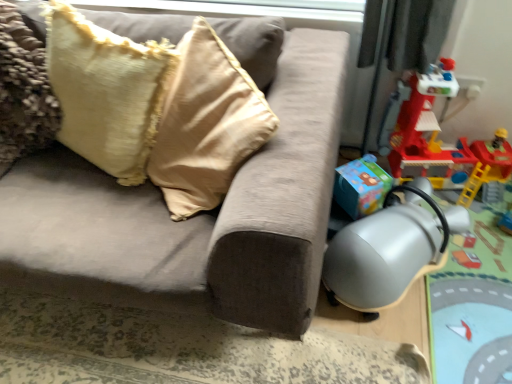
Image resolution: width=512 pixels, height=384 pixels. What do you see at coordinates (197, 215) in the screenshot? I see `suede-like beige couch at center` at bounding box center [197, 215].

At what (x,y) coordinates should I click in order to perform the action: click on suede-like beige couch at center. Please return your answer as a coordinate pair (x, y). Looking at the image, I should click on (197, 215).

Which object is positioned more to the left, velvet beige pillow at upper left or suede-like beige couch at center?

Positioned to the left is suede-like beige couch at center.

Is velvet beige pillow at upper left facing towards suede-like beige couch at center?

Yes, velvet beige pillow at upper left faces towards suede-like beige couch at center.

Is velvet beige pillow at upper left wider or thinner than suede-like beige couch at center?

In the image, velvet beige pillow at upper left appears to be more narrow than suede-like beige couch at center.

From the image's perspective, which object appears higher, velvet beige pillow at upper left or suede-like beige couch at center?

velvet beige pillow at upper left, from the image's perspective.

Considering the relative sizes of velvet beige pillow at upper left and rubberized red playset at right in the image provided, is velvet beige pillow at upper left wider than rubberized red playset at right?

Incorrect, the width of velvet beige pillow at upper left does not surpass that of rubberized red playset at right.

Between point (114, 113) and point (425, 104), which one is positioned in front?

Positioned in front is point (114, 113).

Is velvet beige pillow at upper left facing away from rubberized red playset at right?

velvet beige pillow at upper left is not turned away from rubberized red playset at right.

Can you tell me how much velvet beige pillow at upper left and rubberized red playset at right differ in facing direction?

The facing directions of velvet beige pillow at upper left and rubberized red playset at right are 15.2 degrees apart.

Identify the location of swivel chair that appears behind the velvet beige pillow at upper left. The image size is (512, 384). (390, 249).

Considering the sizes of objects velvet beige pillow at upper left and silver metallic swivel chair at lower right in the image provided, who is smaller, velvet beige pillow at upper left or silver metallic swivel chair at lower right?

silver metallic swivel chair at lower right is smaller.

Is velvet beige pillow at upper left aimed at silver metallic swivel chair at lower right?

No, velvet beige pillow at upper left is not turned towards silver metallic swivel chair at lower right.

Is silver metallic swivel chair at lower right bigger than velvet beige pillow at upper left?

Incorrect, silver metallic swivel chair at lower right is not larger than velvet beige pillow at upper left.

Who is more distant, silver metallic swivel chair at lower right or velvet beige pillow at upper left?

silver metallic swivel chair at lower right is further from the camera.

Considering the positions of points (440, 250) and (126, 60), is point (440, 250) closer to camera compared to point (126, 60)?

No, it is not.

From a real-world perspective, does silver metallic swivel chair at lower right stand above velvet beige pillow at upper left?

No, from a real-world perspective, silver metallic swivel chair at lower right is not on top of velvet beige pillow at upper left.

Is silver metallic swivel chair at lower right bigger than rubberized red playset at right?

No, silver metallic swivel chair at lower right is not bigger than rubberized red playset at right.

Would you consider silver metallic swivel chair at lower right to be distant from rubberized red playset at right?

silver metallic swivel chair at lower right is actually quite close to rubberized red playset at right.

Between silver metallic swivel chair at lower right and rubberized red playset at right, which one appears on the left side from the viewer's perspective?

Positioned to the left is silver metallic swivel chair at lower right.

Based on the photo, is silver metallic swivel chair at lower right surrounding rubberized red playset at right?

No, rubberized red playset at right is not inside silver metallic swivel chair at lower right.

Which is in front, silver metallic swivel chair at lower right or suede-like beige couch at center?

suede-like beige couch at center is closer to the camera.

Based on the photo, is silver metallic swivel chair at lower right positioned far away from suede-like beige couch at center?

No, silver metallic swivel chair at lower right is in close proximity to suede-like beige couch at center.

Could you tell me if silver metallic swivel chair at lower right is turned towards suede-like beige couch at center?

No, silver metallic swivel chair at lower right is not facing towards suede-like beige couch at center.

From the image's perspective, is silver metallic swivel chair at lower right below suede-like beige couch at center?

Yes, from the image's perspective, silver metallic swivel chair at lower right is beneath suede-like beige couch at center.

Looking at this image, does rubberized red playset at right have a lesser height compared to silver metallic swivel chair at lower right?

In fact, rubberized red playset at right may be taller than silver metallic swivel chair at lower right.

Considering the sizes of objects rubberized red playset at right and silver metallic swivel chair at lower right in the image provided, who is bigger, rubberized red playset at right or silver metallic swivel chair at lower right?

rubberized red playset at right is bigger.

Image resolution: width=512 pixels, height=384 pixels. Identify the location of toy above the silver metallic swivel chair at lower right (from a real-world perspective). (440, 141).

Which of these two, rubberized red playset at right or silver metallic swivel chair at lower right, is wider?

silver metallic swivel chair at lower right is wider.

What are the coordinates of `pillow located above the suede-like beige couch at center (from a real-world perspective)` in the screenshot? It's located at (106, 91).

I want to click on pillow that is on the left side of rubberized red playset at right, so click(106, 91).

Based on their spatial positions, is suede-like beige couch at center or silver metallic swivel chair at lower right closer to velvet beige pillow at upper left?

Based on the image, suede-like beige couch at center appears to be nearer to velvet beige pillow at upper left.

Estimate the real-world distances between objects in this image. Which object is further from rubberized red playset at right, velvet beige pillow at upper left or silver metallic swivel chair at lower right?

Among the two, velvet beige pillow at upper left is located further to rubberized red playset at right.

Estimate the real-world distances between objects in this image. Which object is closer to silver metallic swivel chair at lower right, rubberized red playset at right or velvet beige pillow at upper left?

rubberized red playset at right lies closer to silver metallic swivel chair at lower right than the other object.

Estimate the real-world distances between objects in this image. Which object is closer to rubberized red playset at right, silver metallic swivel chair at lower right or velvet beige pillow at upper left?

Among the two, silver metallic swivel chair at lower right is located nearer to rubberized red playset at right.

Consider the image. Which object lies further to the anchor point suede-like beige couch at center, silver metallic swivel chair at lower right or velvet beige pillow at upper left?

silver metallic swivel chair at lower right.

Which object lies further to the anchor point silver metallic swivel chair at lower right, suede-like beige couch at center or rubberized red playset at right?

The object further to silver metallic swivel chair at lower right is suede-like beige couch at center.

From the image, which object appears to be farther from suede-like beige couch at center, velvet beige pillow at upper left or silver metallic swivel chair at lower right?

The object further to suede-like beige couch at center is silver metallic swivel chair at lower right.

Which object lies nearer to the anchor point suede-like beige couch at center, rubberized red playset at right or velvet beige pillow at upper left?

velvet beige pillow at upper left is positioned closer to the anchor suede-like beige couch at center.

Where is `pillow situated between suede-like beige couch at center and rubberized red playset at right from left to right`? Image resolution: width=512 pixels, height=384 pixels. pillow situated between suede-like beige couch at center and rubberized red playset at right from left to right is located at coordinates (106, 91).

Locate an element on the screen. The image size is (512, 384). swivel chair between velvet beige pillow at upper left and rubberized red playset at right is located at coordinates (390, 249).

Find the location of a particular element. pillow between suede-like beige couch at center and silver metallic swivel chair at lower right in the horizontal direction is located at coordinates (106, 91).

This screenshot has height=384, width=512. I want to click on swivel chair located between suede-like beige couch at center and rubberized red playset at right in the left-right direction, so click(390, 249).